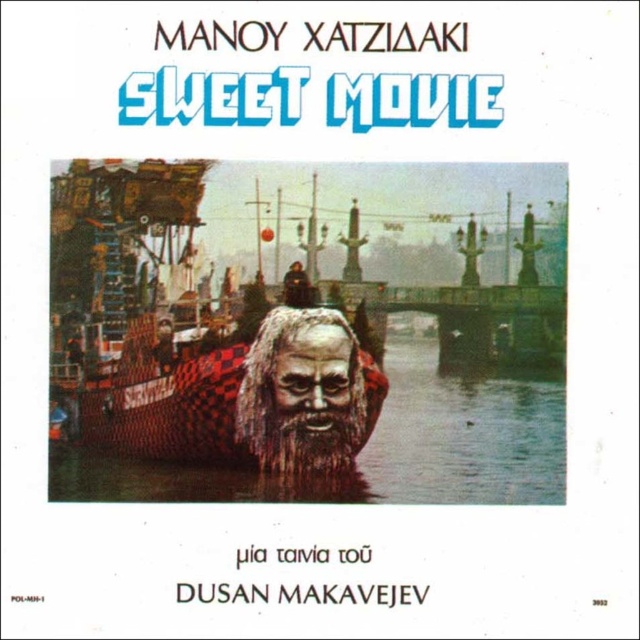
Between grayish textured mask at center and brown textured face at center, which one has less height?

With less height is brown textured face at center.

Who is taller, grayish textured mask at center or brown textured face at center?

grayish textured mask at center is taller.

Measure the distance between point (288, 326) and camera.

The distance of point (288, 326) from camera is 133.43 meters.

At what (x,y) coordinates should I click in order to perform the action: click on grayish textured mask at center. Please return your answer as a coordinate pair (x, y). Looking at the image, I should click on (307, 394).

Does metallic water at center lie in front of grayish textured mask at center?

No, metallic water at center is behind grayish textured mask at center.

Does metallic water at center appear over grayish textured mask at center?

No.

Where is `metallic water at center`? Image resolution: width=640 pixels, height=640 pixels. metallic water at center is located at coordinates (465, 435).

Can you confirm if metallic water at center is positioned to the right of brown textured face at center?

In fact, metallic water at center is to the left of brown textured face at center.

The image size is (640, 640). Describe the element at coordinates (465, 435) in the screenshot. I see `metallic water at center` at that location.

Locate an element on the screen. The image size is (640, 640). metallic water at center is located at coordinates (465, 435).